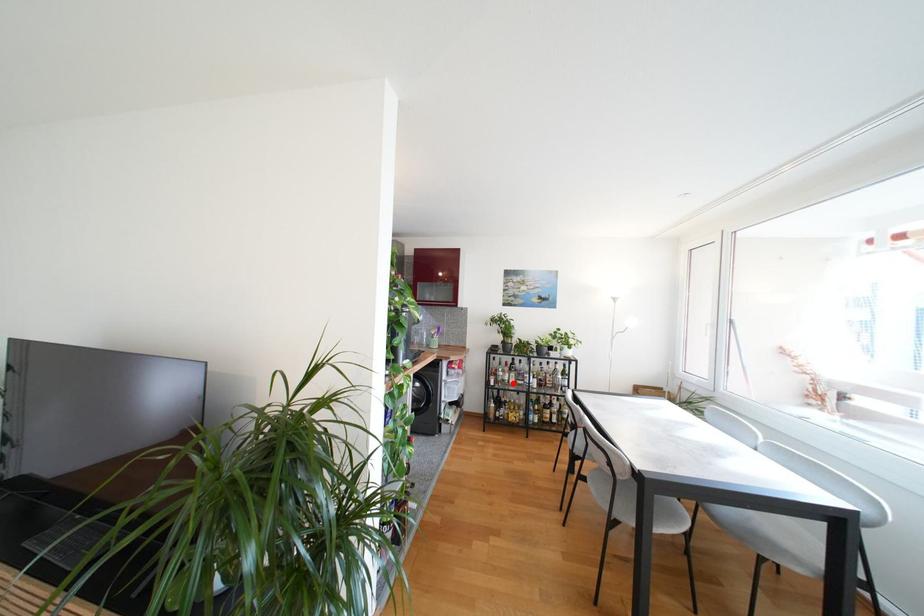
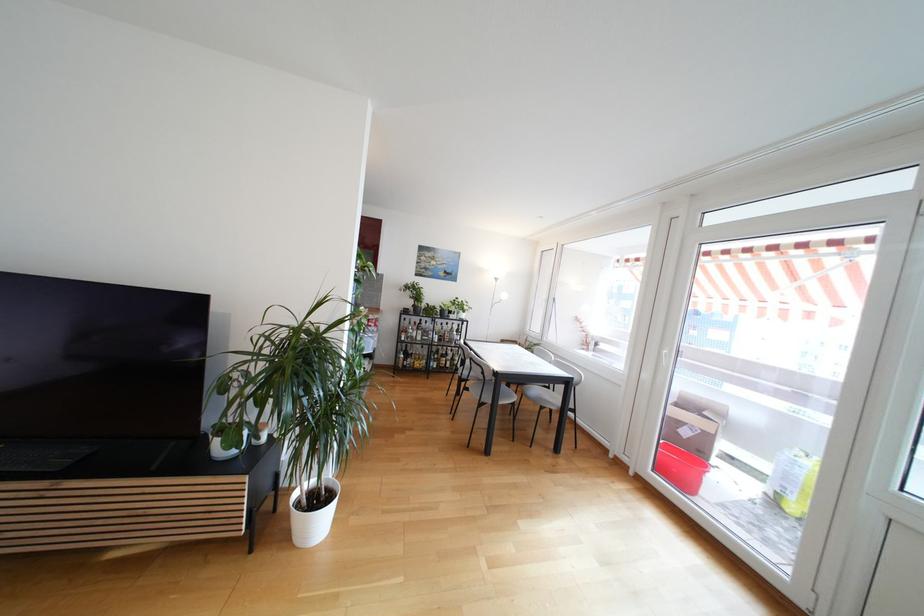
Locate, in the second image, the point that corresponds to the highlighted location in the first image.

(419, 339)